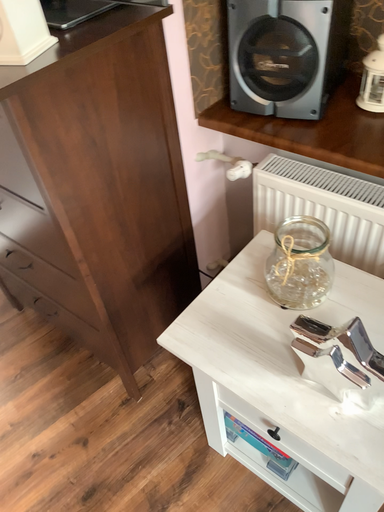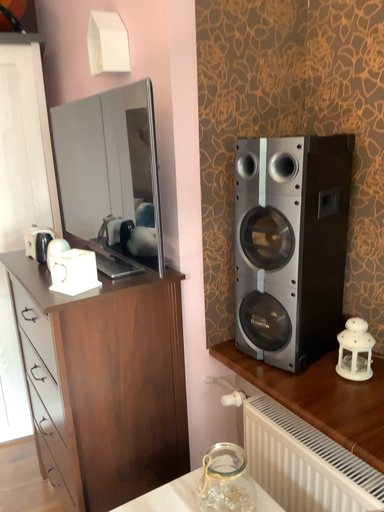
Question: How did the camera likely rotate when shooting the video?

Choices:
 (A) rotated upward
 (B) rotated downward

Answer: (A)